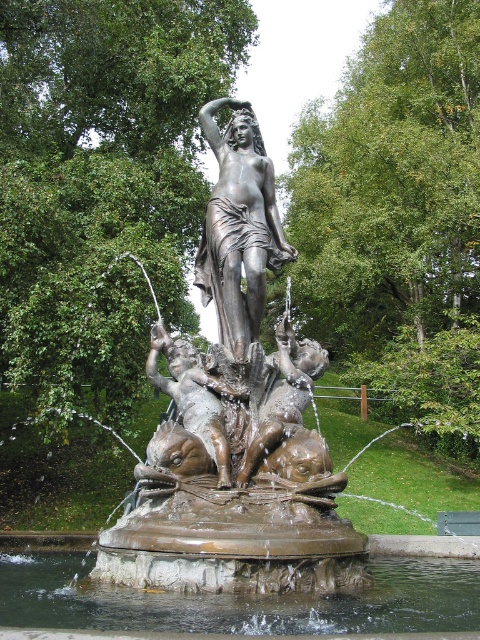
Is shiny bronze statue at center to the left of bronze cherub at center from the viewer's perspective?

Incorrect, shiny bronze statue at center is not on the left side of bronze cherub at center.

Who is more forward, (238, 154) or (193, 392)?

Point (193, 392)

In order to click on shiny bronze statue at center in this screenshot , I will do [x=239, y=225].

Can you confirm if bronze statue at center is positioned to the right of clear water at fountain center?

Correct, you'll find bronze statue at center to the right of clear water at fountain center.

Can you confirm if bronze statue at center is wider than clear water at fountain center?

No, bronze statue at center is not wider than clear water at fountain center.

Who is more forward, (x=133, y=572) or (x=72, y=577)?

Point (x=133, y=572)

I want to click on bronze statue at center, so click(x=236, y=420).

Is point (455, 592) in front of point (250, 125)?

Yes, it is.

The image size is (480, 640). In order to click on clear water at fountain center in this screenshot , I will do `click(240, 600)`.